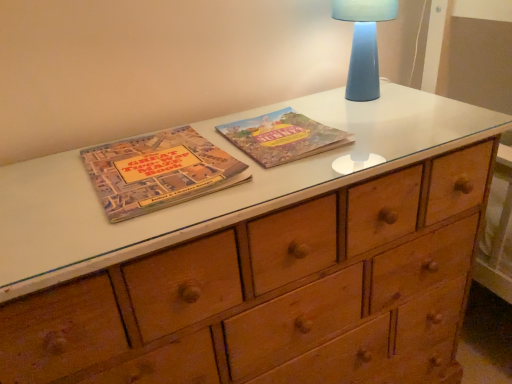
Question: Should I look upward or downward to see matte paper book at center, which appears as the 2th paperback book when viewed from the left?

Choices:
 (A) up
 (B) down

Answer: (A)

Question: From a real-world perspective, is matte cardboard book at center-left, placed as the 1th paperback book when sorted from left to right, under blue ceramic lamp at upper right?

Choices:
 (A) yes
 (B) no

Answer: (A)

Question: Is matte cardboard book at center-left, placed as the 1th paperback book when sorted from left to right, positioned beyond the bounds of blue ceramic lamp at upper right?

Choices:
 (A) yes
 (B) no

Answer: (A)

Question: From the image's perspective, is matte cardboard book at center-left, placed as the 1th paperback book when sorted from left to right, above blue ceramic lamp at upper right?

Choices:
 (A) no
 (B) yes

Answer: (A)

Question: Does matte cardboard book at center-left, the second paperback book viewed from the right, have a greater height compared to blue ceramic lamp at upper right?

Choices:
 (A) no
 (B) yes

Answer: (A)

Question: Does matte cardboard book at center-left, the second paperback book viewed from the right, come in front of blue ceramic lamp at upper right?

Choices:
 (A) yes
 (B) no

Answer: (A)

Question: Considering the relative sizes of matte cardboard book at center-left, placed as the 1th paperback book when sorted from left to right, and blue ceramic lamp at upper right in the image provided, is matte cardboard book at center-left, placed as the 1th paperback book when sorted from left to right, smaller than blue ceramic lamp at upper right?

Choices:
 (A) yes
 (B) no

Answer: (A)

Question: Is matte paper book at center, the first paperback book from the right, taller than matte cardboard book at center-left, the second paperback book viewed from the right?

Choices:
 (A) no
 (B) yes

Answer: (A)

Question: From a real-world perspective, is matte paper book at center, the first paperback book from the right, positioned over matte cardboard book at center-left, the second paperback book viewed from the right, based on gravity?

Choices:
 (A) no
 (B) yes

Answer: (A)

Question: Does matte paper book at center, which appears as the 2th paperback book when viewed from the left, come behind matte cardboard book at center-left, placed as the 1th paperback book when sorted from left to right?

Choices:
 (A) no
 (B) yes

Answer: (B)

Question: Can you confirm if matte paper book at center, which appears as the 2th paperback book when viewed from the left, is shorter than matte cardboard book at center-left, placed as the 1th paperback book when sorted from left to right?

Choices:
 (A) no
 (B) yes

Answer: (B)

Question: From the image's perspective, is matte paper book at center, the first paperback book from the right, on top of matte cardboard book at center-left, the second paperback book viewed from the right?

Choices:
 (A) no
 (B) yes

Answer: (B)

Question: Is matte paper book at center, the first paperback book from the right, oriented away from matte cardboard book at center-left, placed as the 1th paperback book when sorted from left to right?

Choices:
 (A) yes
 (B) no

Answer: (B)

Question: Does blue ceramic lamp at upper right lie in front of matte cardboard book at center-left, the second paperback book viewed from the right?

Choices:
 (A) no
 (B) yes

Answer: (A)